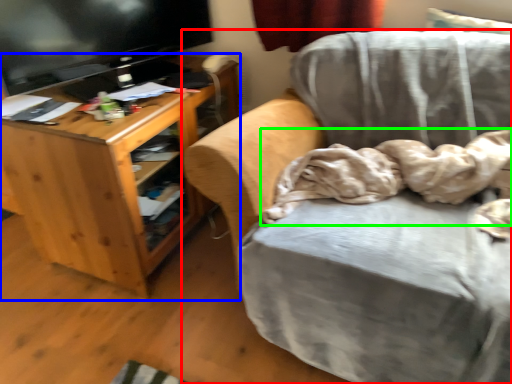
Question: Considering the real-world distances, which object is closest to chair (highlighted by a red box)? desk (highlighted by a blue box) or blanket (highlighted by a green box).

Choices:
 (A) desk
 (B) blanket

Answer: (B)